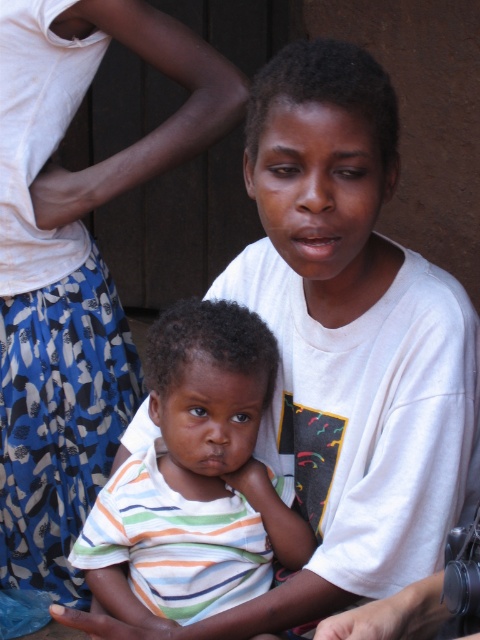
You are a photographer taking a picture of the scene described. You need to focus on the white cotton shirt at upper center. Where exactly should you aim your camera lens to capture it?

You should aim your camera lens at point coordinates (74,264) to capture the white cotton shirt at upper center.

You are a tailor who needs to determine which shirt requires more fabric to make between the white cotton shirt at upper center and the striped cotton shirt at center. Based on the image, which one would you choose?

The white cotton shirt at upper center is bigger than the striped cotton shirt at center, so it would require more fabric to make.

You are a photographer setting up for a family portrait. You need to ensure that the white cotton shirt at upper center and the striped cotton shirt at center are both visible in the frame. Based on their positions, which shirt should you focus on first to ensure both are in focus?

The white cotton shirt at upper center is above the striped cotton shirt at center, so focusing on the white cotton shirt at upper center first will help ensure both shirts are in focus as it is positioned higher in the frame.